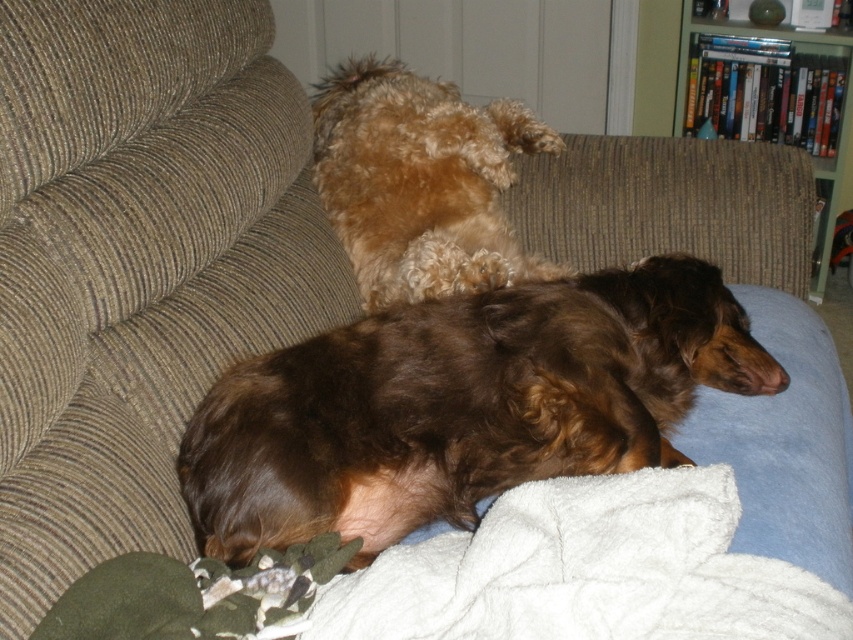
You are a dog owner who wants to place a new white soft blanket at lower center on the couch where the two dogs are resting. According to the image, is the point at coordinates [585,572] suitable for placing the blanket without overlapping any of the dogs?

The point at coordinates [585,572] has the white soft blanket at lower center already placed there, so placing another blanket would overlap with the existing one.

You are a photographer standing in front of the couch where the brown curly fur dog at center is resting. You want to take a closeup photo of the dog without moving any furniture. Can you get a clear shot of the dog if your camera has a minimum focusing distance of 36 inches?

The brown curly fur dog at center is 38.14 inches from the viewer. Since the minimum focusing distance of the camera is 36 inches, the photographer can take a clear closeup photo of the dog without moving any furniture because the dog is within the camera range.